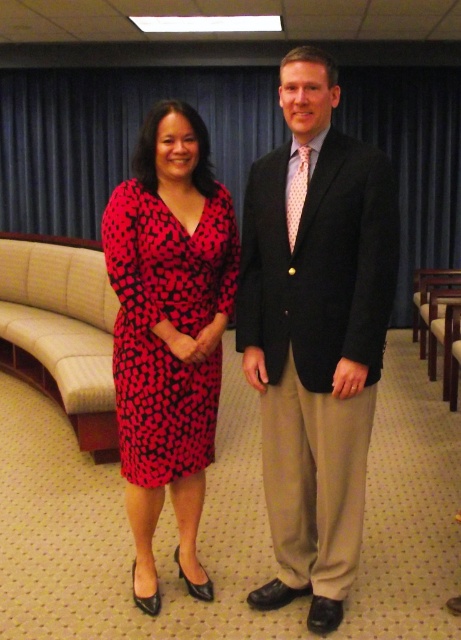
You are an event planner arranging a photoshoot and need to ensure proper lighting. The matte black suit at center and the red dotted fabric dress at center are both in the center of the frame. Which object is located lower in the image?

The matte black suit at center is positioned under the red dotted fabric dress at center, so it is located lower in the image.

You are standing in the office and need to reach a point that is exactly 2 meters away from you. Is the point at coordinates point (291, 356) within your target distance?

The point at point (291, 356) is 1.91 meters away from the viewer, which is slightly less than 2 meters. Therefore, it is not exactly at the target distance of 2 meters.